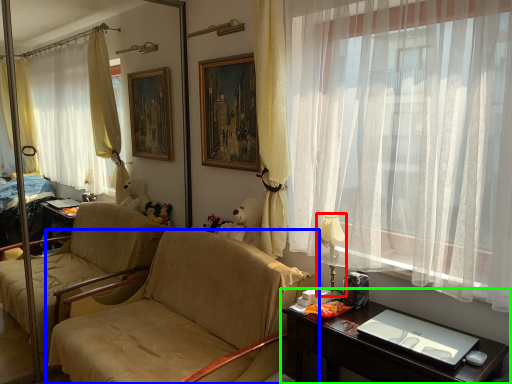
Question: Which object is the farthest from lamp (highlighted by a red box)? Choose among these: chair (highlighted by a blue box) or desk (highlighted by a green box).

Choices:
 (A) chair
 (B) desk

Answer: (A)